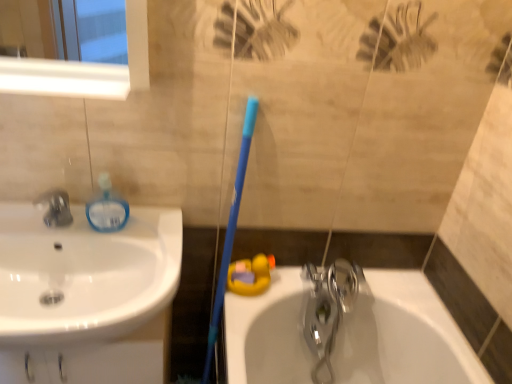
Question: Is white glossy sink at left at the right side of polished chrome faucet at lower center, which is counted as the 2th tap, starting from the left?

Choices:
 (A) no
 (B) yes

Answer: (A)

Question: Is polished chrome faucet at lower center, the 1th tap positioned from the bottom, surrounded by white glossy sink at left?

Choices:
 (A) no
 (B) yes

Answer: (A)

Question: From the image's perspective, is white glossy sink at left over polished chrome faucet at lower center, the 1th tap positioned from the bottom?

Choices:
 (A) yes
 (B) no

Answer: (A)

Question: Is the depth of white glossy sink at left greater than that of polished chrome faucet at lower center, arranged as the first tap when viewed from the back?

Choices:
 (A) yes
 (B) no

Answer: (B)

Question: Is white glossy sink at left thinner than polished chrome faucet at lower center, the 2th tap when ordered from top to bottom?

Choices:
 (A) yes
 (B) no

Answer: (B)

Question: Considering their positions, is polished chrome faucet at lower center, which is counted as the 2th tap, starting from the left, located in front of or behind blue plastic toothbrush at center?

Choices:
 (A) behind
 (B) front

Answer: (A)

Question: Is polished chrome faucet at lower center, the 2th tap in the front-to-back sequence, inside or outside of blue plastic toothbrush at center?

Choices:
 (A) outside
 (B) inside

Answer: (A)

Question: Is polished chrome faucet at lower center, which is counted as the 2th tap, starting from the left, taller or shorter than blue plastic toothbrush at center?

Choices:
 (A) tall
 (B) short

Answer: (B)

Question: Is polished chrome faucet at lower center, arranged as the 1th tap when viewed from the right, wider or thinner than blue plastic toothbrush at center?

Choices:
 (A) wide
 (B) thin

Answer: (B)

Question: Is blue plastic toothbrush at center wider or thinner than white glossy sink at left?

Choices:
 (A) thin
 (B) wide

Answer: (A)

Question: From a real-world perspective, relative to white glossy sink at left, is blue plastic toothbrush at center vertically above or below?

Choices:
 (A) above
 (B) below

Answer: (B)

Question: Considering the positions of blue plastic toothbrush at center and white glossy sink at left in the image, is blue plastic toothbrush at center taller or shorter than white glossy sink at left?

Choices:
 (A) tall
 (B) short

Answer: (A)

Question: Is blue plastic toothbrush at center inside the boundaries of white glossy sink at left, or outside?

Choices:
 (A) inside
 (B) outside

Answer: (B)

Question: From a real-world perspective, is matte black faucet at left, the first tap viewed from the top, positioned above or below white glossy sink at left?

Choices:
 (A) below
 (B) above

Answer: (B)

Question: Is point (67, 220) closer or farther from the camera than point (100, 319)?

Choices:
 (A) closer
 (B) farther

Answer: (B)